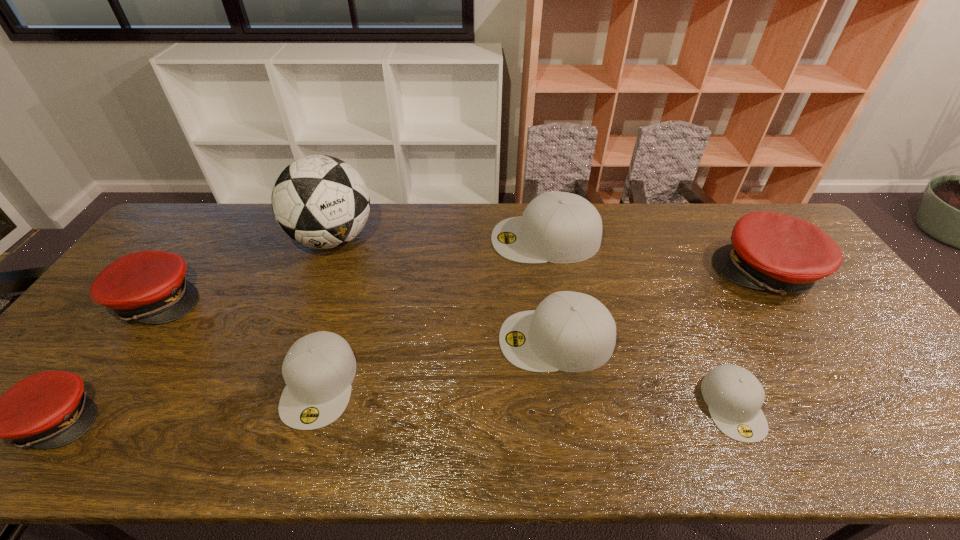
Locate which cap ranks fifth in proximity to the biggest gray cap. Please provide its 2D coordinates. Your answer should be formatted as a tuple, i.e. [(x, y)], where the tuple contains the x and y coordinates of a point satisfying the conditions above.

[(149, 286)]

Select which cap is the sixth closest to the sixth cap from left to right. Please provide its 2D coordinates. Your answer should be formatted as a tuple, i.e. [(x, y)], where the tuple contains the x and y coordinates of a point satisfying the conditions above.

[(50, 409)]

Find the location of a particular element. Image resolution: width=960 pixels, height=540 pixels. gray cap that is the third nearest to the third smallest gray cap is located at coordinates (319, 368).

Point out which gray cap is positioned as the second nearest to the second smallest gray cap. Please provide its 2D coordinates. Your answer should be formatted as a tuple, i.e. [(x, y)], where the tuple contains the x and y coordinates of a point satisfying the conditions above.

[(558, 227)]

At what (x,y) coordinates should I click in order to perform the action: click on the second closest red cap to the second biggest gray cap. Please return your answer as a coordinate pair (x, y). Image resolution: width=960 pixels, height=540 pixels. Looking at the image, I should click on (149, 286).

Identify the location of red cap that stands as the closest to the rightmost object. (149, 286).

The height and width of the screenshot is (540, 960). I want to click on vacant point that satisfies the following two spatial constraints: 1. on the surface of the black soccer ball where the brand logo is visible; 2. on the front of the second smallest red cap with an emblem, so click(310, 300).

I want to click on vacant point that satisfies the following two spatial constraints: 1. on the front of the biggest red cap with an emblem; 2. on the front-facing side of the third cap from left to right, so click(841, 384).

Locate an element on the screen. This screenshot has height=540, width=960. free location that satisfies the following two spatial constraints: 1. on the surface of the black soccer ball where the brand logo is visible; 2. on the front of the second biggest red cap with an emblem is located at coordinates (310, 300).